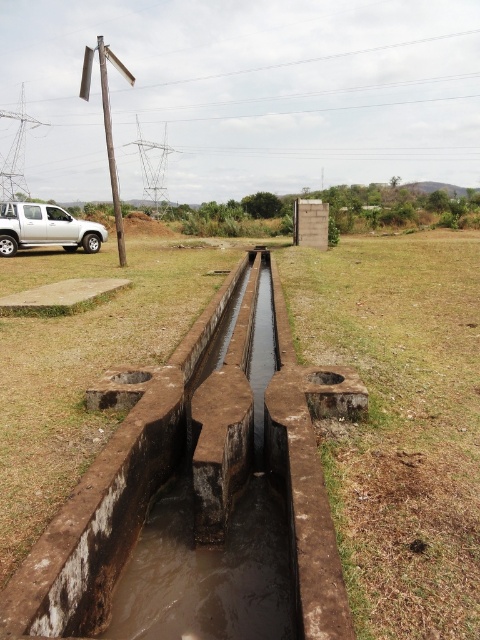
You are standing at the edge of the concrete irrigation canal and see the brown dry grass at lower center and the silver metallic truck at left. Which object is closer to your right side?

The brown dry grass at lower center is to the right of the silver metallic truck at left, so if you are facing the canal, the brown dry grass at lower center would be on your right side.

You are standing at the origin point of the image coordinate system. You want to walk to the brown dry grass at lower center. What are the coordinates you need to move to?

The coordinates of the brown dry grass at lower center are at point (399, 422). So you need to move to coordinates (399, 422).